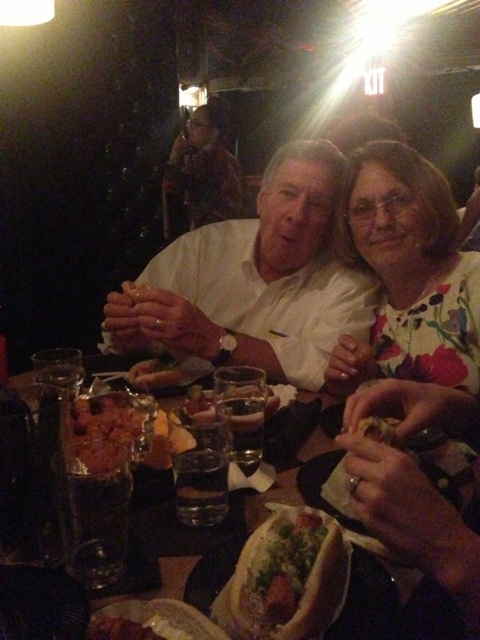
You are a waiter in a restaurant and need to place a new dish on the table. The table has a shiny metallic bowl at center and a shiny brown bread at lower left. Where should you place the dish so it doesn

The shiny metallic bowl at center is above the shiny brown bread at lower left, so you should place the dish below the shiny metallic bowl at center near the shiny brown bread at lower left to ensure it is visible and accessible.

You are a waiter in a restaurant. You need to place a new drink order for the customer wearing the white matte shirt at center. Where should you place the drink relative to the clear glass water at center?

The white matte shirt at center is much taller than the clear glass water at center, so you should place the new drink order below the clear glass water at center to ensure it is within reach of the customer.

You are standing at the entrance of the restaurant and want to locate the man wearing the white matte shirt at center. According to the coordinates provided, where should you look to find him?

The white matte shirt at center is located at coordinates point (253, 280).